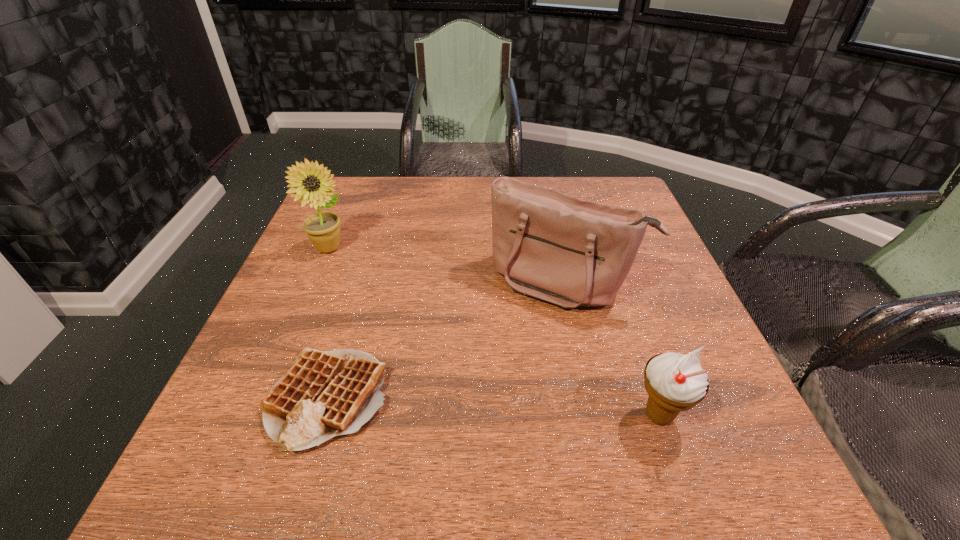
You are a GUI agent. You are given a task and a screenshot of the screen. Output one action in this format:
    pyautogui.click(x=<x>, y=<y>)
    Task: Click on the shortest object
    The width and height of the screenshot is (960, 540).
    Given the screenshot: What is the action you would take?
    pyautogui.click(x=325, y=394)

Where is `icecream`? icecream is located at coordinates (675, 382).

Find the location of a particular element. This screenshot has height=540, width=960. shoulder bag is located at coordinates (548, 245).

Where is `sunflower`? sunflower is located at coordinates (323, 229).

Find the location of a particular element. free region located on the back of the waffle is located at coordinates (348, 332).

Image resolution: width=960 pixels, height=540 pixels. In order to click on free space located 0.090m on the left of the third tallest object in this screenshot , I will do `click(578, 415)`.

Image resolution: width=960 pixels, height=540 pixels. I want to click on vacant space located 0.080m on the front pocket of the shoulder bag, so click(x=519, y=341).

I want to click on vacant space located on the front pocket of the shoulder bag, so click(x=503, y=370).

Identify the location of vacant space located 0.210m on the front pocket of the shoulder bag. The height and width of the screenshot is (540, 960). (492, 391).

Locate an element on the screen. This screenshot has height=540, width=960. vacant space situated 0.180m on the face of the sunflower is located at coordinates (388, 291).